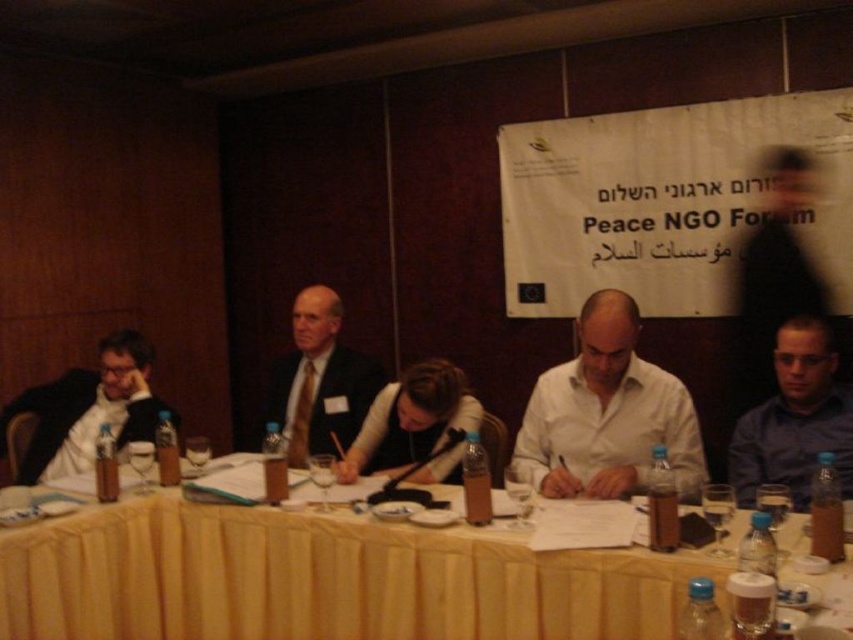
Based on the scene description, can you determine if the white matte shirt at center is wider than the blue shirt at right?

The white matte shirt at center is wider than the blue shirt at right according to the description.

You are a photographer at the Peace NGO Forum. You need to position a camera so that both the point at (80, 461) and the point at (418, 432) are in focus. Which point should you focus on first to ensure both are sharp?

You should focus on point (80, 461) first because it is closer to the viewer than point (418, 432). By focusing on the closer point, the farther point will also be within the depth of field.

You are a photographer at the Peace NGO Forum event, and you need to adjust the focus of your camera. You have two points to focus on in the scene. The first point is at coordinate point(590, 416) and the second is at point(817, 429). Which point is closer to your camera lens?

Point(590, 416) is closer to the camera lens than point(817, 429) because it is further to the camera according to the description.